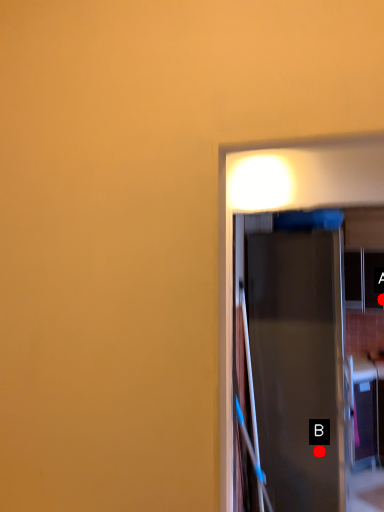
Question: Two points are circled on the image, labeled by A and B beside each circle. Which point appears closest to the camera in this image?

Choices:
 (A) A is closer
 (B) B is closer

Answer: (B)